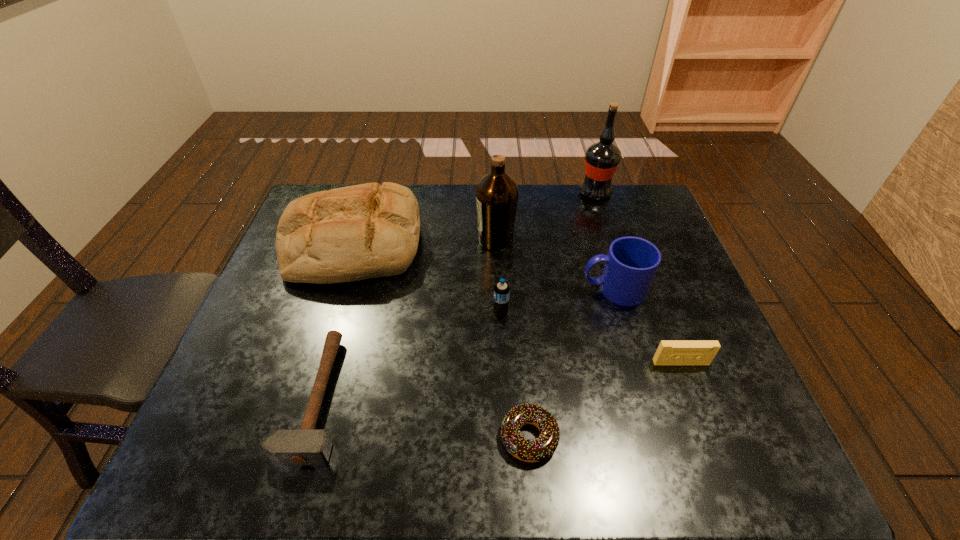
Where is `wine bottle that is at the far edge`? wine bottle that is at the far edge is located at coordinates (601, 159).

This screenshot has width=960, height=540. What are the coordinates of `bread situated at the far edge` in the screenshot? It's located at (347, 234).

Locate an element on the screen. This screenshot has width=960, height=540. hammer at the near edge is located at coordinates (305, 446).

Image resolution: width=960 pixels, height=540 pixels. Identify the location of doughnut that is positioned at the near edge. (543, 447).

Locate an element on the screen. This screenshot has height=540, width=960. bread located at the left edge is located at coordinates (347, 234).

In order to click on hammer located in the left edge section of the desktop in this screenshot , I will do `click(305, 446)`.

Find the location of a particular element. wine bottle located at the right edge is located at coordinates (601, 159).

Locate an element on the screen. This screenshot has width=960, height=540. mug that is at the right edge is located at coordinates (631, 263).

This screenshot has width=960, height=540. In order to click on videotape that is at the right edge in this screenshot , I will do [669, 352].

At what (x,y) coordinates should I click in order to perform the action: click on object located in the far left corner section of the desktop. Please return your answer as a coordinate pair (x, y). Looking at the image, I should click on (347, 234).